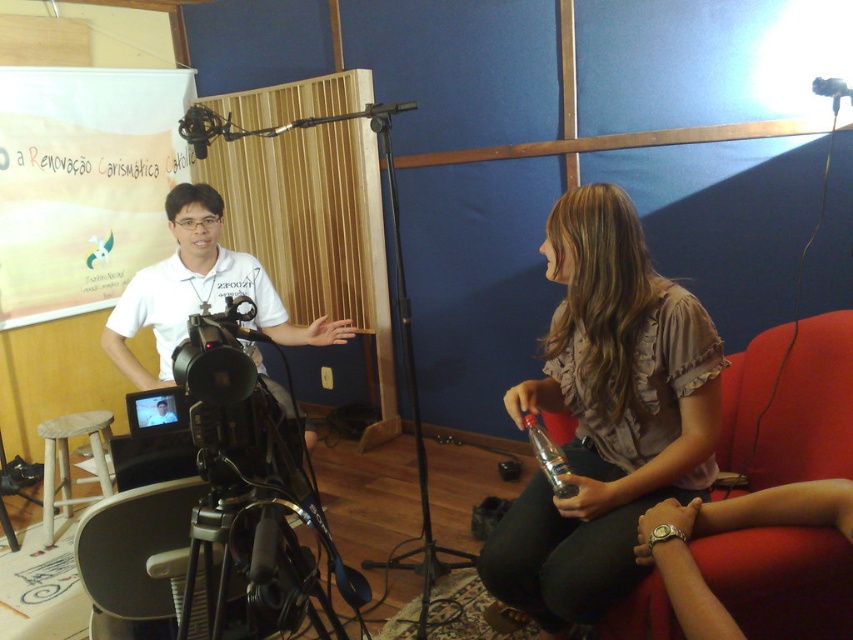
Based on the scene description, which object is shorter between the red fabric armchair at right and the light brown wooden stool at lower left?

The red fabric armchair at right is shorter than the light brown wooden stool at lower left.

You are a technician setting up equipment in the studio. You need to place a new monitor between the red fabric armchair at right and the clear plastic microphone at lower center. Based on their sizes, will the monitor fit if it requires 1.2 meters of space?

The red fabric armchair at right might be wider than the clear plastic microphone at lower center, but without exact measurements, it is uncertain if the 1.2 meters of space is sufficient. Check the actual dimensions before placing the monitor.

You are an assistant helping to set up the studio. You need to place a small prop on top of the light brown wooden stool at lower left so it can be seen by the camera. Will the prop be visible over the matte white shirt at center?

The light brown wooden stool at lower left is taller than the matte white shirt at center, so placing the prop on top of the light brown wooden stool at lower left will make it visible over the matte white shirt at center.